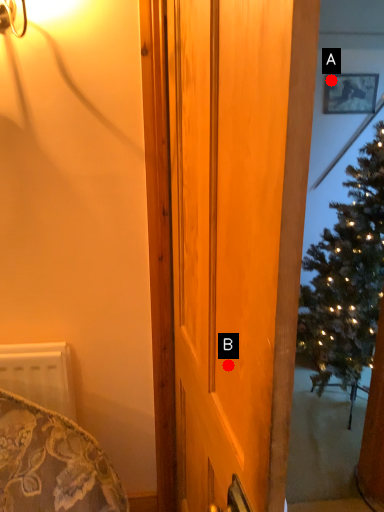
Question: Two points are circled on the image, labeled by A and B beside each circle. Which point is farther from the camera taking this photo?

Choices:
 (A) A is further
 (B) B is further

Answer: (A)